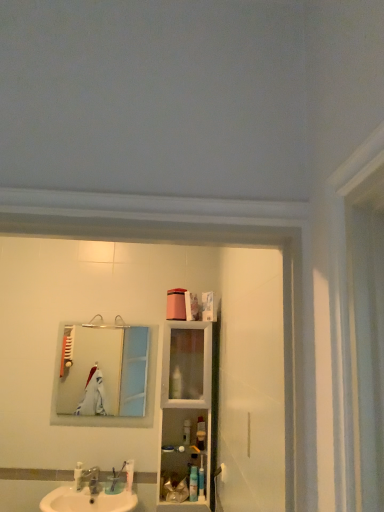
Where is `free space in front of white plastic toothbrush at lower center`? This screenshot has width=384, height=512. free space in front of white plastic toothbrush at lower center is located at coordinates (118, 499).